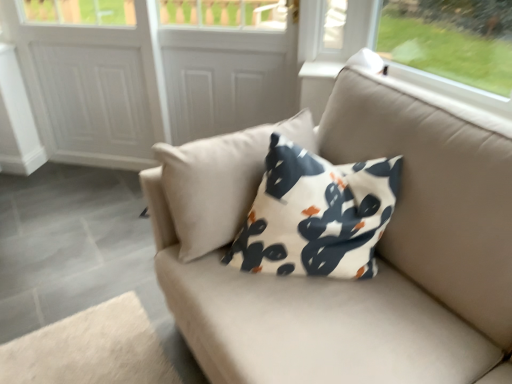
Question: From a real-world perspective, is white matte screen door at upper center, which is the second screen door from right to left, physically located above or below white textured screen door at upper center, marked as the 1th screen door in a left-to-right arrangement?

Choices:
 (A) above
 (B) below

Answer: (A)

Question: Is white matte screen door at upper center, which is the second screen door from right to left, taller or shorter than white textured screen door at upper center, which ranks as the third screen door in right-to-left order?

Choices:
 (A) short
 (B) tall

Answer: (B)

Question: Which is nearer to the white textured screen door at upper center, which ranks as the third screen door in right-to-left order?

Choices:
 (A) white matte screen door at upper center, positioned as the second screen door in left-to-right order
 (B) white matte door at center, acting as the first screen door starting from the right

Answer: (A)

Question: Considering the real-world distances, which object is farthest from the white matte screen door at upper center, which is the second screen door from right to left?

Choices:
 (A) white textured screen door at upper center, which ranks as the third screen door in right-to-left order
 (B) white matte door at center, the 3th screen door when ordered from left to right

Answer: (B)